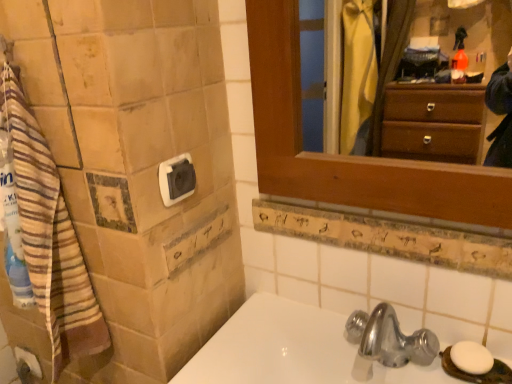
Question: Is wooden ledge at upper center bigger or smaller than white plastic towel bar at upper left?

Choices:
 (A) big
 (B) small

Answer: (A)

Question: Does point (476, 251) appear closer or farther from the camera than point (177, 170)?

Choices:
 (A) farther
 (B) closer

Answer: (B)

Question: Which object is the farthest from the wooden frame at upper right?

Choices:
 (A) wooden ledge at upper center
 (B) white matte toilet paper at lower left
 (C) white plastic towel bar at upper left
 (D) white glossy sink at lower center
 (E) white matte soap at lower right

Answer: (B)

Question: Estimate the real-world distances between objects in this image. Which object is farther from the white plastic towel bar at upper left?

Choices:
 (A) wooden frame at upper right
 (B) white glossy sink at lower center
 (C) white matte soap at lower right
 (D) white matte toilet paper at lower left
 (E) wooden ledge at upper center

Answer: (A)